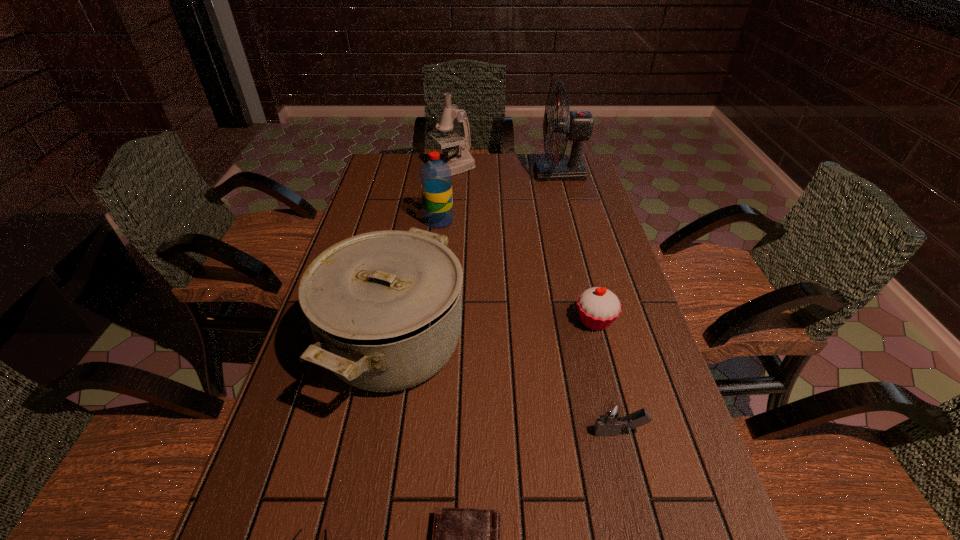
I want to click on the tallest object, so click(578, 125).

Find the location of a particular element. Image resolution: width=960 pixels, height=540 pixels. the second tallest object is located at coordinates (463, 161).

The width and height of the screenshot is (960, 540). I want to click on water bottle, so click(435, 175).

The height and width of the screenshot is (540, 960). Find the location of `saucepan`. saucepan is located at coordinates (385, 308).

You are a GUI agent. You are given a task and a screenshot of the screen. Output one action in this format:
    pyautogui.click(x=<x>, y=<y>)
    Task: Click on the cupcake
    
    Given the screenshot: What is the action you would take?
    pyautogui.click(x=598, y=307)

Identify the location of igniter. (611, 418).

At what (x,y) coordinates should I click in order to perform the action: click on vacant space situated on the front-facing side of the fan. Please return your answer as a coordinate pair (x, y). The width and height of the screenshot is (960, 540). Looking at the image, I should click on (497, 174).

Find the location of a particular element. This screenshot has height=540, width=960. vacant space located on the front-facing side of the fan is located at coordinates (449, 174).

In order to click on free location located 0.050m on the front-facing side of the fan in this screenshot , I will do `click(521, 174)`.

Locate an element on the screen. This screenshot has width=960, height=540. free region located on the left of the microscope is located at coordinates tap(374, 170).